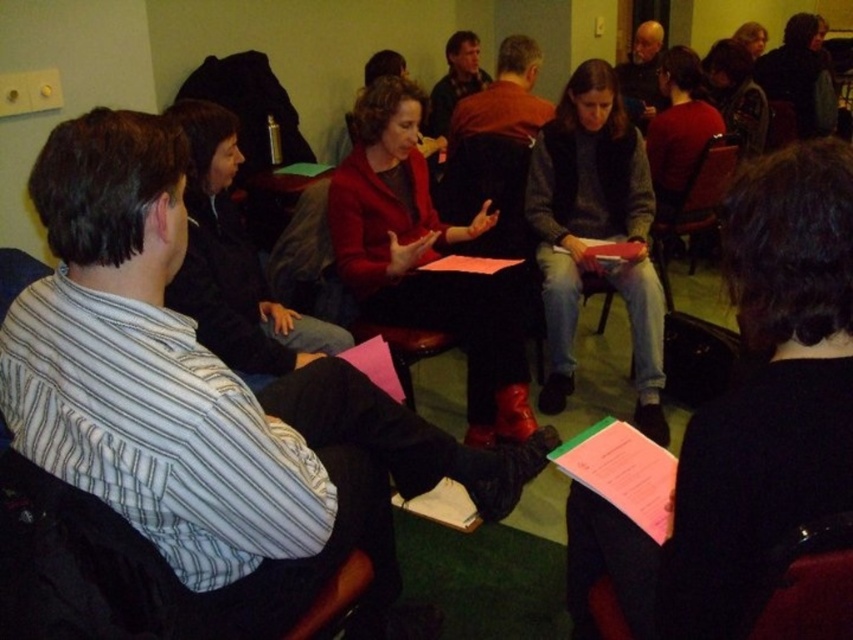
Question: Can you confirm if matte red coat at center is positioned above velvet-like dark red chair at lower right?

Choices:
 (A) yes
 (B) no

Answer: (A)

Question: Can you confirm if matte black jacket at center is positioned below velvet-like dark red chair at lower right?

Choices:
 (A) yes
 (B) no

Answer: (A)

Question: Which of these objects is positioned farthest from the velvet-like dark red chair at lower right?

Choices:
 (A) matte red coat at center
 (B) matte black jacket at center

Answer: (A)

Question: Which of these objects is positioned closest to the matte red coat at center?

Choices:
 (A) matte black jacket at center
 (B) knit gray sweater at center
 (C) velvet-like dark red chair at lower right

Answer: (B)

Question: Can you confirm if matte black jacket at center is positioned to the right of matte red coat at center?

Choices:
 (A) yes
 (B) no

Answer: (A)

Question: Among these objects, which one is nearest to the camera?

Choices:
 (A) matte black jacket at center
 (B) knit gray sweater at center

Answer: (A)